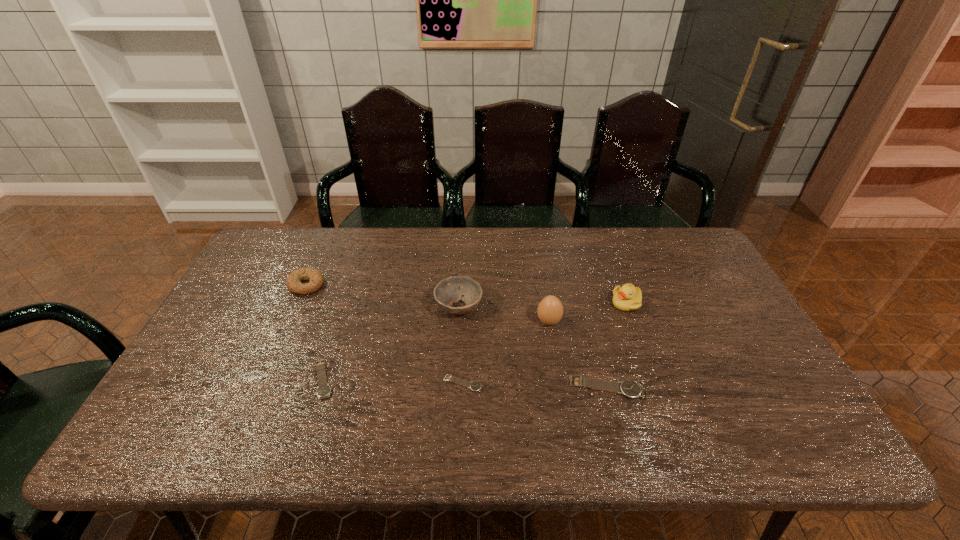
The height and width of the screenshot is (540, 960). In order to click on vacant area that lies between the second watch from left to right and the bowl in this screenshot , I will do `click(461, 346)`.

Image resolution: width=960 pixels, height=540 pixels. What are the coordinates of `free space between the bagel and the second watch from right to left` in the screenshot? It's located at (385, 334).

Locate an element on the screen. This screenshot has width=960, height=540. free space between the duckling and the shortest object is located at coordinates (545, 343).

Where is `free space between the rightmost watch and the bowl`? The width and height of the screenshot is (960, 540). free space between the rightmost watch and the bowl is located at coordinates (533, 348).

Locate an element on the screen. free space between the leftmost object and the boiled egg is located at coordinates (427, 303).

The height and width of the screenshot is (540, 960). I want to click on vacant space that's between the bagel and the rightmost watch, so click(456, 336).

Locate an element on the screen. The width and height of the screenshot is (960, 540). free space between the duckling and the rightmost watch is located at coordinates (616, 346).

Where is `object that ranks as the closest to the tallest object`? object that ranks as the closest to the tallest object is located at coordinates (448, 291).

Identify which object is the fourth nearest to the rightmost watch. Please provide its 2D coordinates. Your answer should be formatted as a tuple, i.e. [(x, y)], where the tuple contains the x and y coordinates of a point satisfying the conditions above.

[(448, 291)]

Select which watch is the second closest to the duckling. Please provide its 2D coordinates. Your answer should be formatted as a tuple, i.e. [(x, y)], where the tuple contains the x and y coordinates of a point satisfying the conditions above.

[(475, 386)]